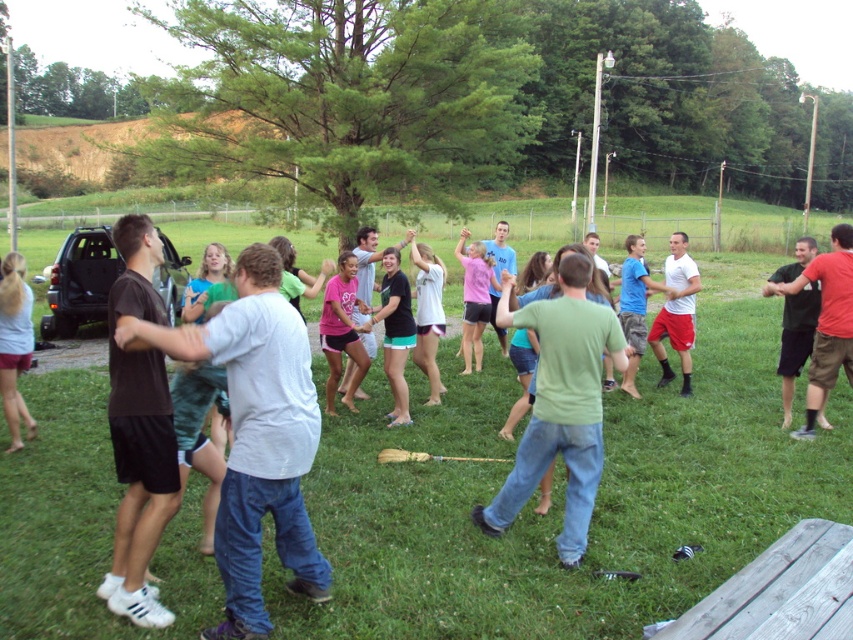
Question: Which object is positioned farthest from the matte black shorts at center?

Choices:
 (A) light gray cotton shirt at lower left
 (B) black cotton shirt at center

Answer: (B)

Question: Which object is positioned farthest from the matte green shirt at center?

Choices:
 (A) pink matte shirt at center
 (B) green matte shirt at center
 (C) matte black shorts at center

Answer: (B)

Question: Does white t-shirt at center appear on the left side of matte black shorts at center?

Choices:
 (A) no
 (B) yes

Answer: (A)

Question: Which point is closer to the camera?

Choices:
 (A) (546, 452)
 (B) (10, 436)
 (C) (474, 362)
 (D) (686, 285)

Answer: (A)

Question: Is green grass at center to the right of matte green shirt at center from the viewer's perspective?

Choices:
 (A) no
 (B) yes

Answer: (B)

Question: Does dark brown t-shirt at center appear under white cotton shirt at center?

Choices:
 (A) no
 (B) yes

Answer: (B)